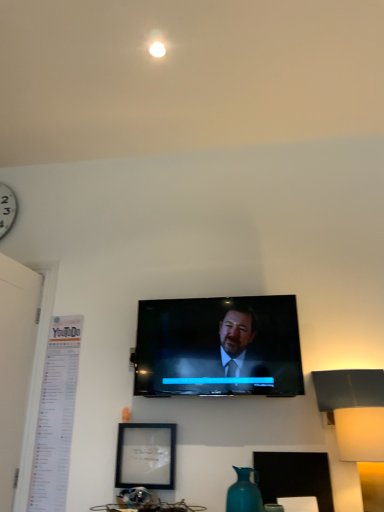
Question: Is matte black picture frame at lower center not within white matte table lamp at right?

Choices:
 (A) no
 (B) yes

Answer: (B)

Question: Is matte black picture frame at lower center positioned with its back to white matte table lamp at right?

Choices:
 (A) yes
 (B) no

Answer: (B)

Question: Considering the relative positions of matte black picture frame at lower center and white matte table lamp at right in the image provided, is matte black picture frame at lower center to the right of white matte table lamp at right from the viewer's perspective?

Choices:
 (A) yes
 (B) no

Answer: (B)

Question: From the image's perspective, would you say matte black picture frame at lower center is positioned over white matte table lamp at right?

Choices:
 (A) yes
 (B) no

Answer: (B)

Question: Is matte black picture frame at lower center wider than white matte table lamp at right?

Choices:
 (A) yes
 (B) no

Answer: (B)

Question: Are matte black picture frame at lower center and white matte table lamp at right far apart?

Choices:
 (A) yes
 (B) no

Answer: (B)

Question: From a real-world perspective, is matte black tv at center positioned under white matte table lamp at right based on gravity?

Choices:
 (A) no
 (B) yes

Answer: (A)

Question: Could white matte table lamp at right be considered to be inside matte black tv at center?

Choices:
 (A) yes
 (B) no

Answer: (B)

Question: Is matte black tv at center oriented towards white matte table lamp at right?

Choices:
 (A) no
 (B) yes

Answer: (A)

Question: Would you say matte black tv at center is a long distance from white matte table lamp at right?

Choices:
 (A) yes
 (B) no

Answer: (B)

Question: Does matte black tv at center have a smaller size compared to white matte table lamp at right?

Choices:
 (A) no
 (B) yes

Answer: (A)

Question: From the image's perspective, is matte black tv at center on white matte table lamp at right?

Choices:
 (A) yes
 (B) no

Answer: (A)

Question: Does matte black tv at center lie in front of matte black picture frame at lower center?

Choices:
 (A) no
 (B) yes

Answer: (B)